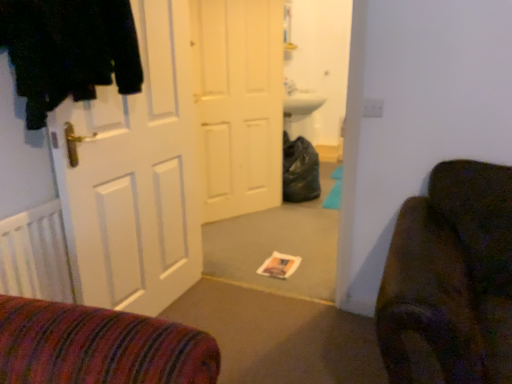
Question: Considering the positions of point (169, 205) and point (87, 74), is point (169, 205) closer or farther from the camera than point (87, 74)?

Choices:
 (A) closer
 (B) farther

Answer: (B)

Question: Is white matte door at left, which ranks as the 2th door in back-to-front order, inside or outside of black fuzzy coat at left?

Choices:
 (A) inside
 (B) outside

Answer: (B)

Question: Which object is positioned farthest from the black fuzzy coat at left?

Choices:
 (A) white matte door at left, which ranks as the 2th door in back-to-front order
 (B) white matte door at center, arranged as the first door when viewed from the back

Answer: (B)

Question: Which object is positioned closest to the white matte door at left, which appears as the first door when viewed from the front?

Choices:
 (A) black fuzzy coat at left
 (B) white matte door at center, arranged as the first door when viewed from the back

Answer: (A)